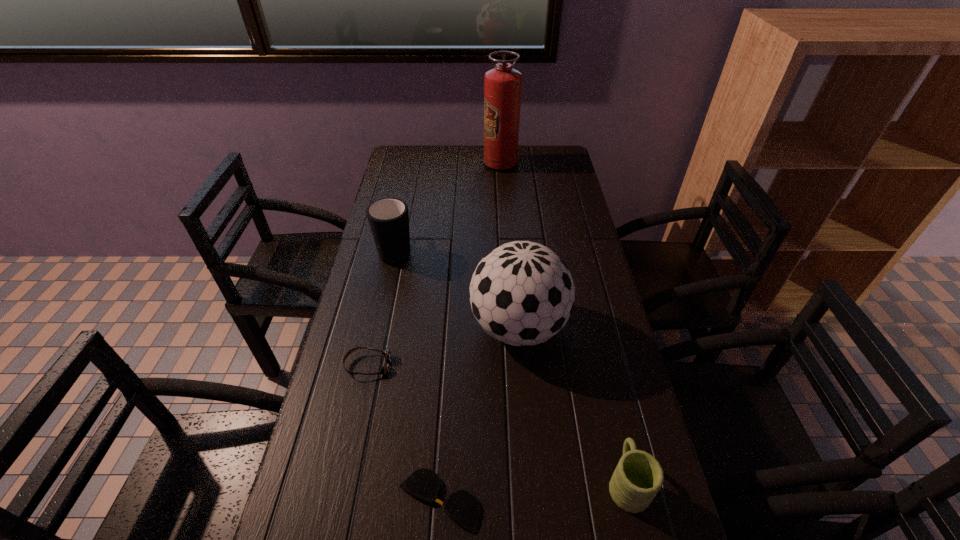
Locate an element on the screen. The width and height of the screenshot is (960, 540). the closest object to the right mug is located at coordinates (521, 293).

Image resolution: width=960 pixels, height=540 pixels. I want to click on vacant space that satisfies the following two spatial constraints: 1. on the label side of the tallest object; 2. on the side of the right mug with the handle, so click(521, 482).

At what (x,y) coordinates should I click in order to perform the action: click on vacant space that satisfies the following two spatial constraints: 1. on the label side of the tallest object; 2. on the front side of the shortest object. Please return your answer as a coordinate pair (x, y). This screenshot has width=960, height=540. Looking at the image, I should click on (522, 501).